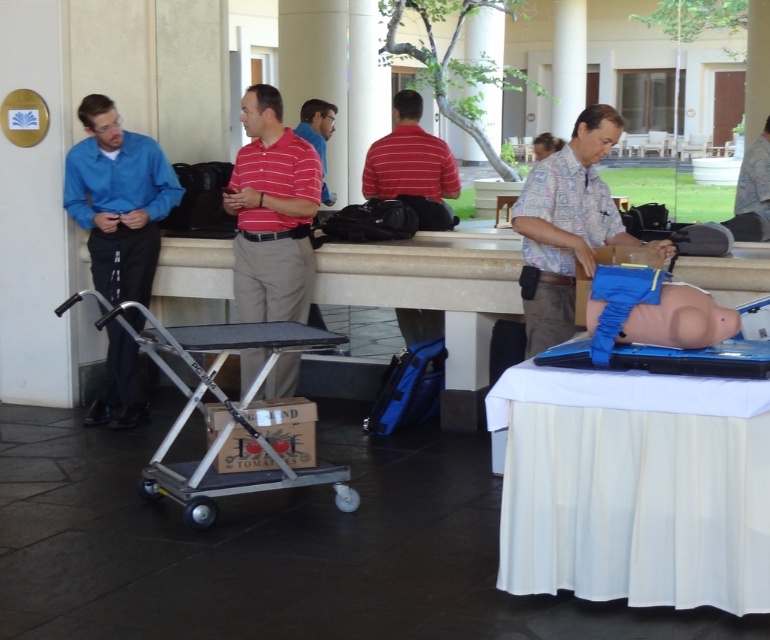
Which of these two, silver metallic cart at center or hawaiian shirt at center, stands shorter?

With less height is silver metallic cart at center.

Does silver metallic cart at center have a larger size compared to hawaiian shirt at center?

Indeed, silver metallic cart at center has a larger size compared to hawaiian shirt at center.

Where is `silver metallic cart at center`? silver metallic cart at center is located at coordinates (223, 408).

The height and width of the screenshot is (640, 770). Identify the location of silver metallic cart at center. pos(223,408).

Which of these two, blue matte shirt at left or striped polo shirt at center, stands shorter?

striped polo shirt at center

Does point (119, 362) lie in front of point (323, 196)?

Yes, it is in front of point (323, 196).

Where is `blue matte shirt at left`? This screenshot has height=640, width=770. blue matte shirt at left is located at coordinates (119, 198).

Between point (583, 525) and point (159, 182), which one is positioned in front?

Point (583, 525) is more forward.

Between white cloth at lower right and blue matte shirt at left, which one appears on the left side from the viewer's perspective?

blue matte shirt at left is more to the left.

Does point (688, 419) lie in front of point (92, 420)?

Yes.

The width and height of the screenshot is (770, 640). I want to click on white cloth at lower right, so click(634, 486).